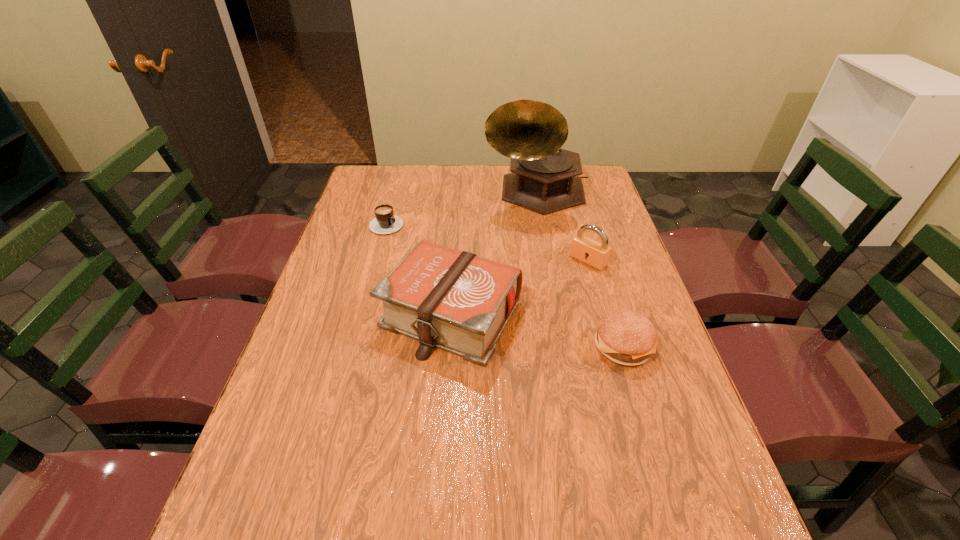
Identify the location of padlock situated at the right edge. The image size is (960, 540). (596, 254).

This screenshot has width=960, height=540. Find the location of `object that is at the far right corner`. object that is at the far right corner is located at coordinates (545, 179).

In the image, there is a desktop. Where is `vacant space at the far edge`? This screenshot has width=960, height=540. vacant space at the far edge is located at coordinates [436, 194].

Find the location of a particular element. vacant position at the near edge of the desktop is located at coordinates (350, 494).

At what (x,y) coordinates should I click in order to perform the action: click on vacant space at the left edge. Please return your answer as a coordinate pair (x, y). The width and height of the screenshot is (960, 540). Looking at the image, I should click on tap(344, 364).

Identify the location of vacant region at the right edge of the desktop. This screenshot has width=960, height=540. 614,282.

Locate an element on the screen. Image resolution: width=960 pixels, height=540 pixels. blank space at the far left corner of the desktop is located at coordinates (384, 166).

In order to click on blank area at the near left corner in this screenshot , I will do `click(318, 490)`.

Identify the location of vacant position at the far right corner of the desktop. This screenshot has height=540, width=960. (585, 193).

Identify the location of free space between the hamburger and the phonograph record. This screenshot has height=540, width=960. (579, 269).